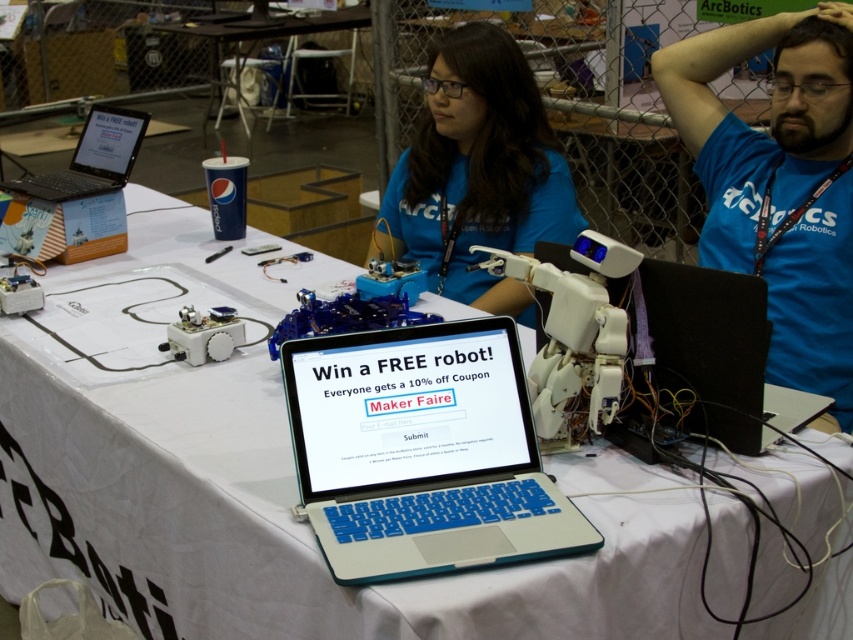
Question: Is blue matte shirt at center to the right of black matte laptop at right from the viewer's perspective?

Choices:
 (A) yes
 (B) no

Answer: (B)

Question: Is white cloth at center bigger than black matte laptop at right?

Choices:
 (A) yes
 (B) no

Answer: (A)

Question: Which of the following is the closest to the observer?

Choices:
 (A) (740, 412)
 (B) (70, 168)

Answer: (A)

Question: Which of the following is the farthest from the observer?

Choices:
 (A) blue matte shirt at center
 (B) black matte laptop at right

Answer: (A)

Question: Which point is closer to the camera?

Choices:
 (A) (38, 196)
 (B) (90, 397)
 (C) (730, 381)
 (D) (670, 104)

Answer: (C)

Question: Is white cloth at center below blue matte shirt at center?

Choices:
 (A) yes
 (B) no

Answer: (A)